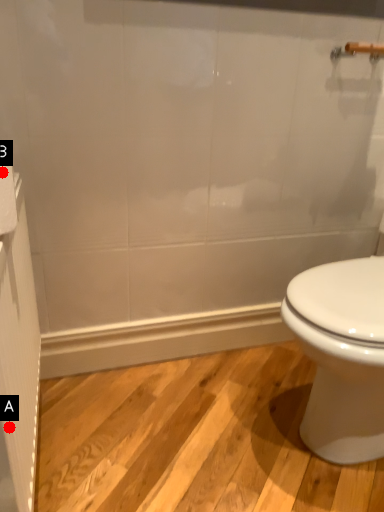
Question: Two points are circled on the image, labeled by A and B beside each circle. Which point is further to the camera?

Choices:
 (A) A is further
 (B) B is further

Answer: (B)